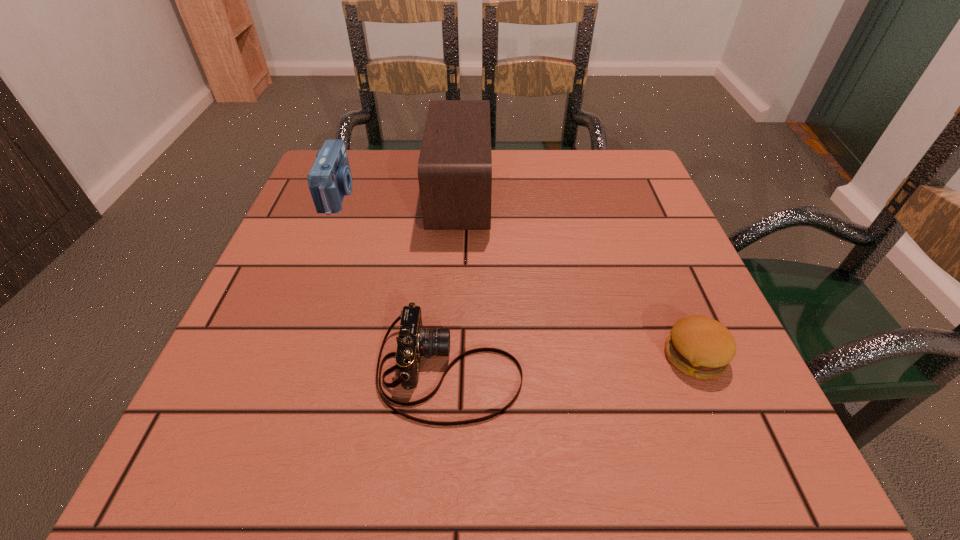
Find the location of a particular element. The width and height of the screenshot is (960, 540). free space that is in between the rightmost object and the nearer camera is located at coordinates (572, 363).

What are the coordinates of `empty location between the tallest object and the shorter camera` in the screenshot? It's located at (455, 283).

Identify the location of vacant area that lies between the hamburger and the taller camera. (516, 275).

Identify the location of vacant area between the radio receiver and the rightmost object. This screenshot has width=960, height=540. (577, 276).

The image size is (960, 540). What are the coordinates of `the closest object to the nearer camera` in the screenshot? It's located at (455, 163).

This screenshot has height=540, width=960. I want to click on object that is the second nearest to the rightmost object, so click(x=455, y=163).

At what (x,y) coordinates should I click in order to perform the action: click on vacant region that satisfies the following two spatial constraints: 1. on the front-facing side of the radio receiver; 2. on the left side of the hamburger. Please return your answer as a coordinate pair (x, y). This screenshot has width=960, height=540. Looking at the image, I should click on (451, 356).

Locate an element on the screen. The height and width of the screenshot is (540, 960). vacant space that satisfies the following two spatial constraints: 1. on the lens of the farther camera; 2. on the right side of the hamburger is located at coordinates (275, 356).

Locate an element on the screen. This screenshot has width=960, height=540. free space that satisfies the following two spatial constraints: 1. on the front-facing side of the radio receiver; 2. on the left side of the rightmost object is located at coordinates (451, 356).

Locate an element on the screen. vacant space that satisfies the following two spatial constraints: 1. on the lens of the hamburger; 2. on the left side of the second tallest object is located at coordinates (275, 356).